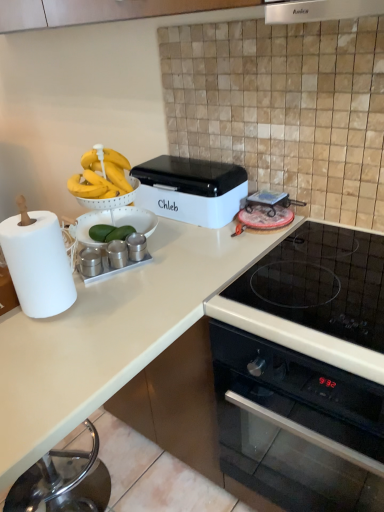
I want to click on empty space that is in between white paper at left and satin silver canisters at center, so click(90, 282).